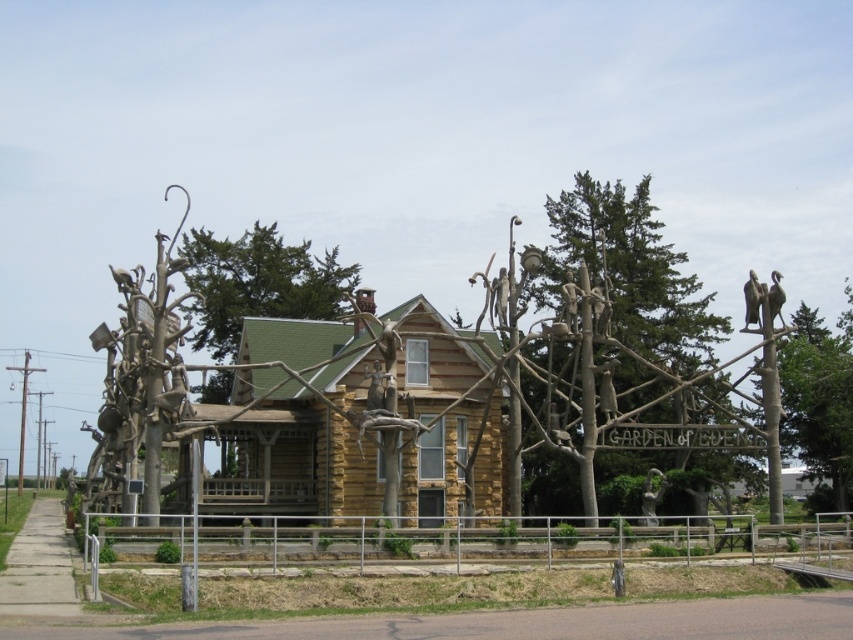
Find the location of a particular element. Image resolution: width=853 pixels, height=640 pixels. wooden log cabin at center is located at coordinates (299, 422).

Does wooden log cabin at center appear over polished bronze statue at upper right?

Incorrect, wooden log cabin at center is not positioned above polished bronze statue at upper right.

Is point (292, 472) positioned behind point (766, 317)?

Yes, point (292, 472) is behind point (766, 317).

Where is `wooden log cabin at center`? This screenshot has height=640, width=853. wooden log cabin at center is located at coordinates (299, 422).

Which is more to the right, wooden log cabin at center or wooden sculpture at center?

From the viewer's perspective, wooden sculpture at center appears more on the right side.

Is wooden log cabin at center shorter than wooden sculpture at center?

Correct, wooden log cabin at center is not as tall as wooden sculpture at center.

Which is behind, point (415, 460) or point (606, 236)?

The point (606, 236) is more distant.

The image size is (853, 640). I want to click on wooden log cabin at center, so (x=299, y=422).

Who is positioned more to the left, wooden log cabin at center or polished bronze statue at center?

Positioned to the left is wooden log cabin at center.

Who is lower down, wooden log cabin at center or polished bronze statue at center?

polished bronze statue at center

At what (x,y) coordinates should I click in order to perform the action: click on wooden log cabin at center. Please return your answer as a coordinate pair (x, y). The height and width of the screenshot is (640, 853). Looking at the image, I should click on (299, 422).